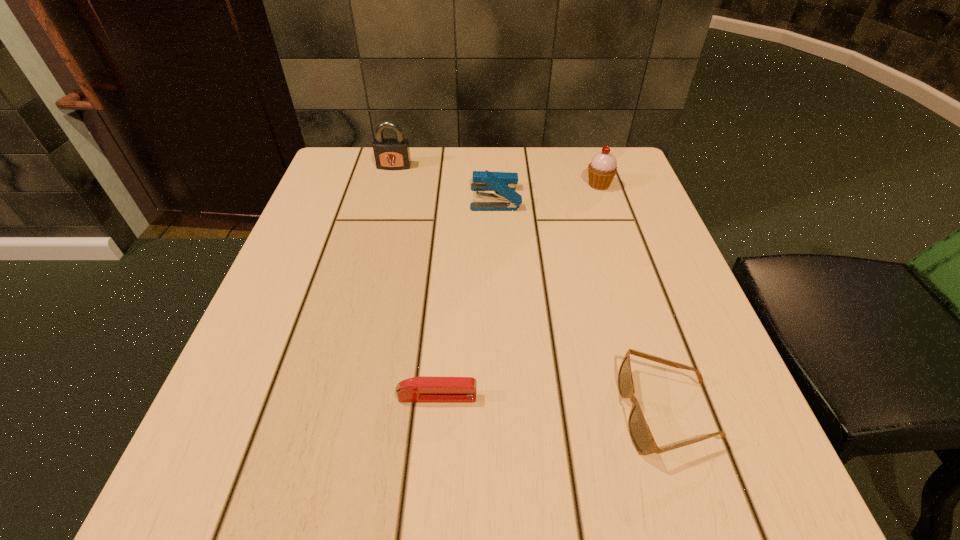
At what (x,y) coordinates should I click in order to perform the action: click on unoccupied area between the farther stapler and the second shortest object. Please return your answer as a coordinate pair (x, y). Looking at the image, I should click on (582, 305).

Find the location of a particular element. The width and height of the screenshot is (960, 540). unoccupied position between the second shortest object and the leftmost object is located at coordinates (531, 289).

Find the location of a particular element. blank region between the cupcake and the fourth tallest object is located at coordinates (634, 298).

In order to click on free space between the cupcake and the taller stapler in this screenshot , I will do `click(547, 191)`.

Locate an element on the screen. free area in between the cupcake and the second shortest object is located at coordinates [x=634, y=298].

At what (x,y) coordinates should I click in order to perform the action: click on empty location between the second shortest object and the farther stapler. Please return your answer as a coordinate pair (x, y). Looking at the image, I should click on (582, 305).

Image resolution: width=960 pixels, height=540 pixels. I want to click on empty location between the farther stapler and the farthest object, so click(x=444, y=182).

The width and height of the screenshot is (960, 540). I want to click on vacant space in between the shortest object and the fourth tallest object, so click(x=552, y=404).

Identify the location of object that stands as the second closest to the padlock. (603, 167).

Where is `the fourth closest object to the farther stapler`? This screenshot has height=540, width=960. the fourth closest object to the farther stapler is located at coordinates (422, 389).